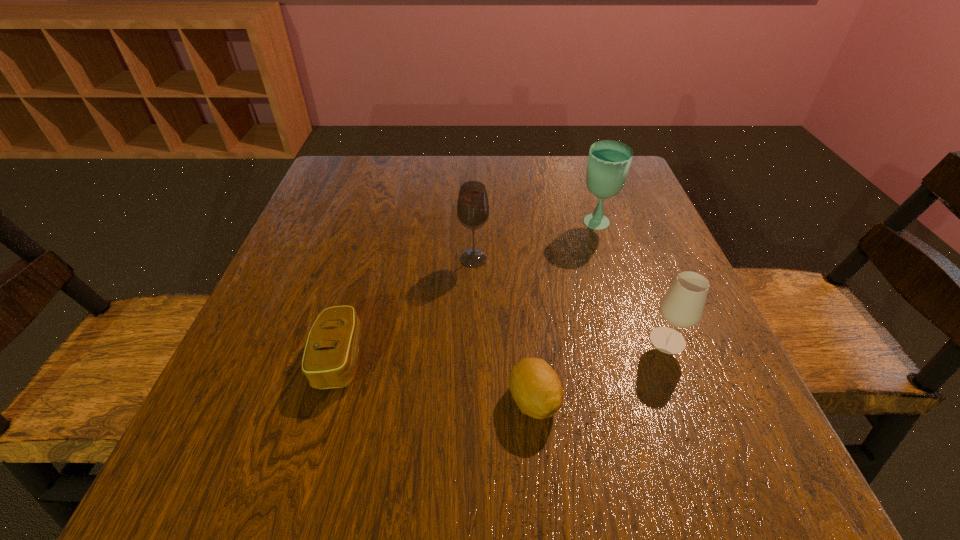
Identify the location of vacant region between the leftmost object and the fourth object from right to left. The image size is (960, 540). (407, 308).

Locate an element on the screen. object identified as the closest to the shortest glass is located at coordinates (535, 387).

Find the location of `the second closest object to the leftmost object`. the second closest object to the leftmost object is located at coordinates (535, 387).

Where is `glass that can be found as the closest to the leftmost glass`? glass that can be found as the closest to the leftmost glass is located at coordinates (608, 164).

Find the location of a particular element. This screenshot has width=960, height=540. glass that is the second nearest to the clutch bag is located at coordinates (682, 306).

The height and width of the screenshot is (540, 960). Identify the location of vacant space that satisfies the following two spatial constraints: 1. on the front side of the third shortest object; 2. on the zipper side of the clutch bag. coord(675,358).

Identify the location of blank area in the image that satisfies the following two spatial constraints: 1. on the front side of the leftmost glass; 2. on the zipper side of the leftmost object. (472, 358).